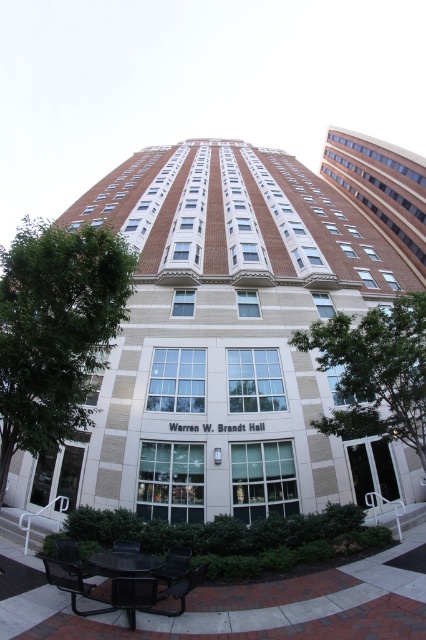
Who is higher up, brick textured building at upper right or metallic silver bench at lower left?

Positioned higher is brick textured building at upper right.

Can you confirm if brick textured building at upper right is bigger than metallic silver bench at lower left?

Indeed, brick textured building at upper right has a larger size compared to metallic silver bench at lower left.

Which is behind, point (396, 250) or point (62, 545)?

Point (396, 250)

Locate an element on the screen. This screenshot has width=426, height=640. brick textured building at upper right is located at coordinates (382, 188).

Which is more to the right, brick building at center or brick textured building at upper right?

Positioned to the right is brick textured building at upper right.

Is brick building at center to the left of brick textured building at upper right from the viewer's perspective?

Indeed, brick building at center is positioned on the left side of brick textured building at upper right.

Locate an element on the screen. The image size is (426, 640). brick building at center is located at coordinates (238, 330).

Describe the element at coordinates (238, 330) in the screenshot. The width and height of the screenshot is (426, 640). I see `brick building at center` at that location.

Does brick building at center have a smaller size compared to black plastic park bench at lower center?

Incorrect, brick building at center is not smaller in size than black plastic park bench at lower center.

Is point (236, 240) less distant than point (187, 556)?

No, (236, 240) is behind (187, 556).

This screenshot has height=640, width=426. Find the location of `brick building at center`. brick building at center is located at coordinates (238, 330).